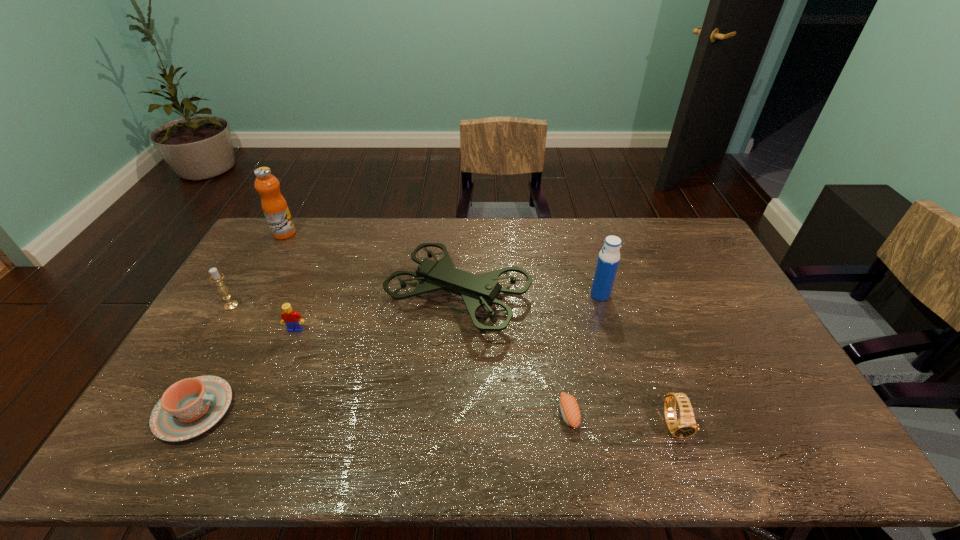
This screenshot has height=540, width=960. Find the location of `free space located 0.230m on the front of the tallest object`. free space located 0.230m on the front of the tallest object is located at coordinates (258, 281).

Find the location of a particular element. vacant area located on the left of the seventh object from left to right is located at coordinates (563, 295).

Where is `free region located 0.160m on the back of the drone`? The height and width of the screenshot is (540, 960). free region located 0.160m on the back of the drone is located at coordinates (463, 232).

You are a GUI agent. You are given a task and a screenshot of the screen. Output one action in this format:
    pyautogui.click(x=<x>, y=<y>)
    Task: Click on the vacant space positioned 0.210m on the front of the fifth shortest object
    This screenshot has height=540, width=960.
    Given the screenshot: What is the action you would take?
    pyautogui.click(x=197, y=364)

What are the coordinates of `free region located 0.200m on the face of the Lego` in the screenshot? It's located at (271, 390).

The image size is (960, 540). I want to click on vacant space situated 0.240m on the handle side of the second shortest object, so click(324, 410).

Identify the location of vacant space located on the left of the sixth object from left to right. This screenshot has width=960, height=540. (496, 414).

You are a GUI agent. You are given a task and a screenshot of the screen. Output one action in this format:
    pyautogui.click(x=<x>, y=<y>)
    Task: Click on the object that is at the far edge
    This screenshot has height=540, width=960.
    Given the screenshot: What is the action you would take?
    pyautogui.click(x=275, y=208)

Locate an element on the screen. The width and height of the screenshot is (960, 540). watch that is at the near edge is located at coordinates (686, 426).

In order to click on chinaware at the near edge in this screenshot , I will do `click(188, 408)`.